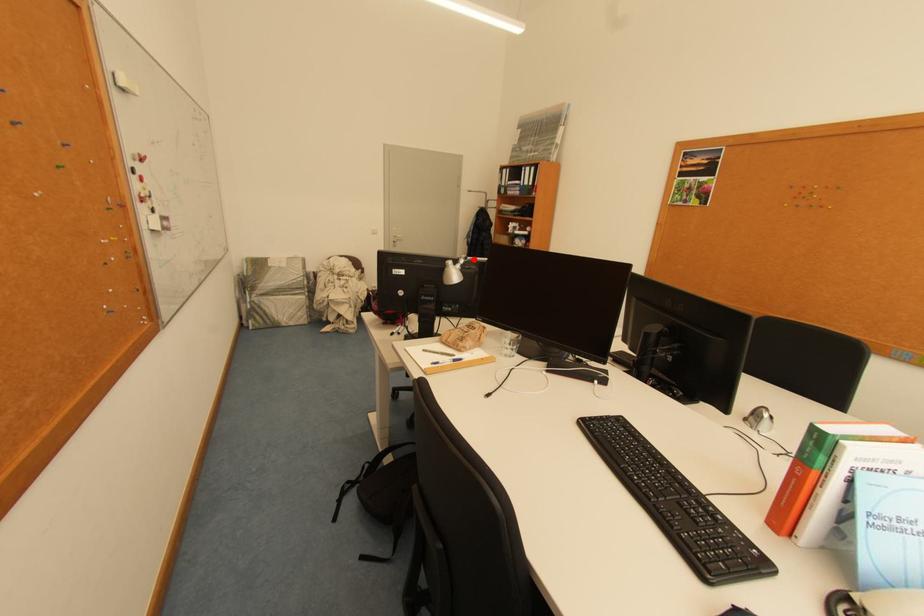
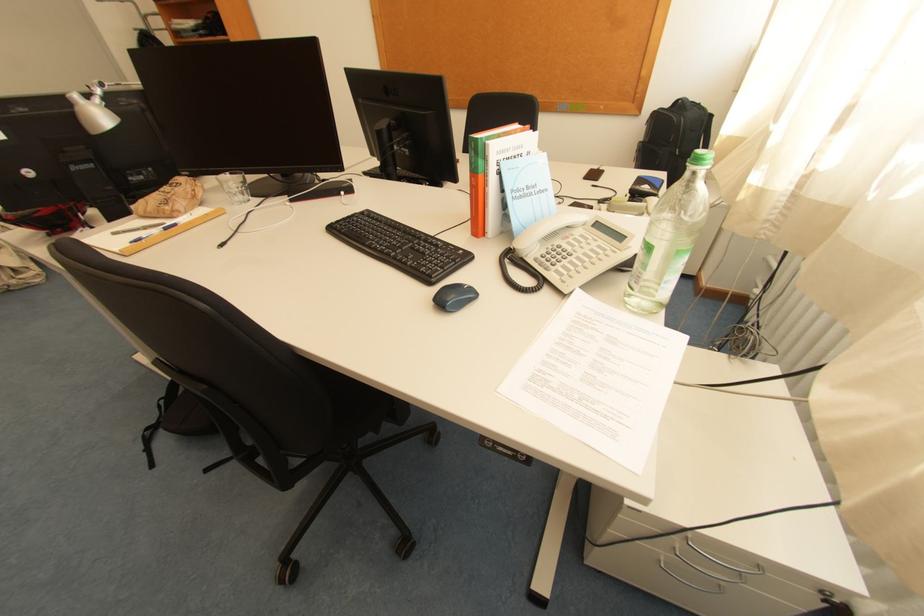
Question: I am providing you with two images of the same scene from different viewpoints. Image1 has a red point marked. In image2, the corresponding 3D location appears at what relative position? Reply with the corresponding letter.

Choices:
 (A) Closer
 (B) Farther

Answer: (B)